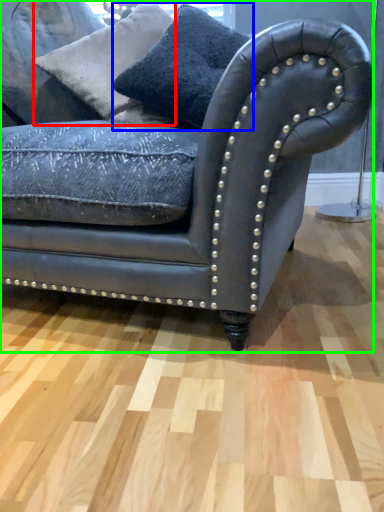
Question: Based on their relative distances, which object is farther from pillow (highlighted by a red box)? Choose from pillow (highlighted by a blue box) and studio couch (highlighted by a green box).

Choices:
 (A) pillow
 (B) studio couch

Answer: (B)